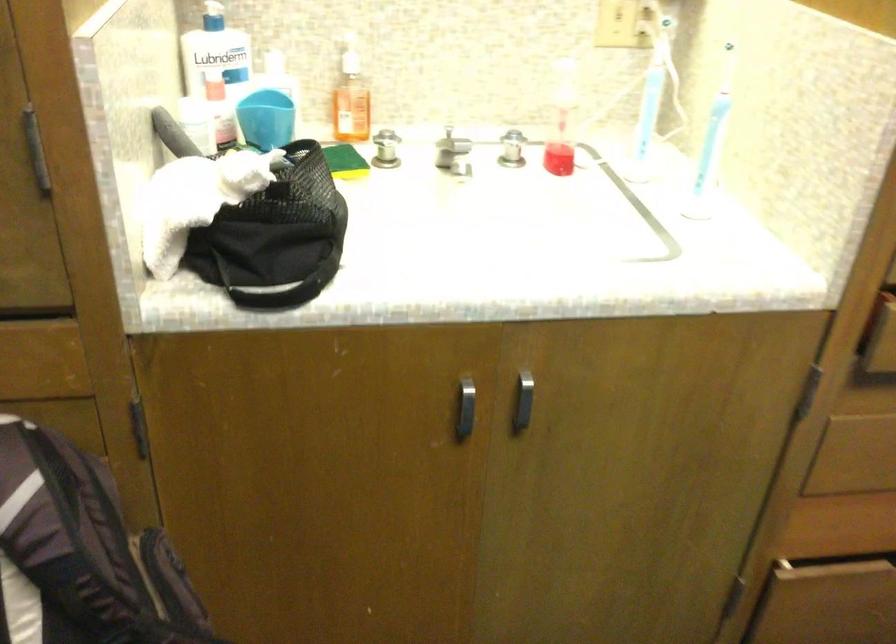
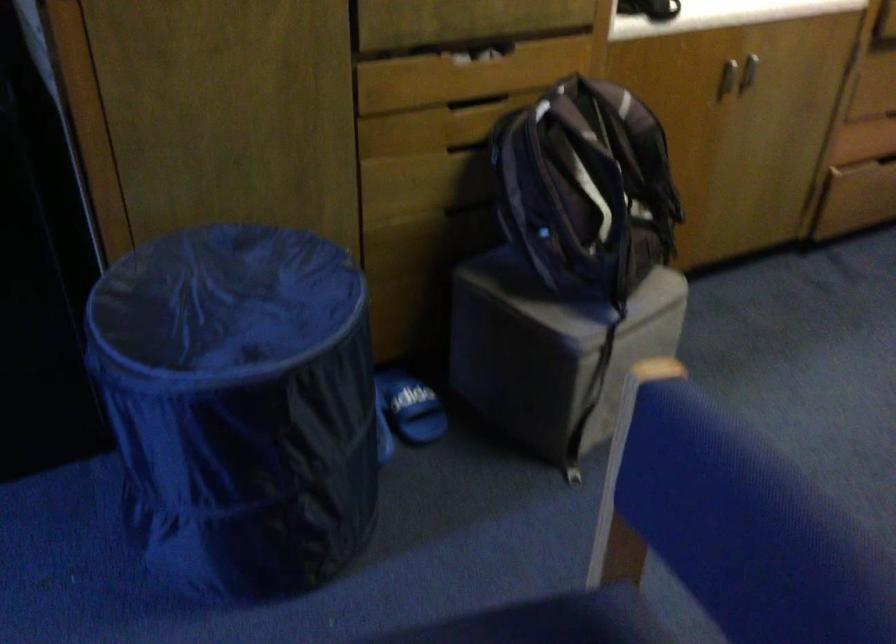
Locate, in the second image, the point that corresponds to pixel 458 429 in the first image.

(728, 79)